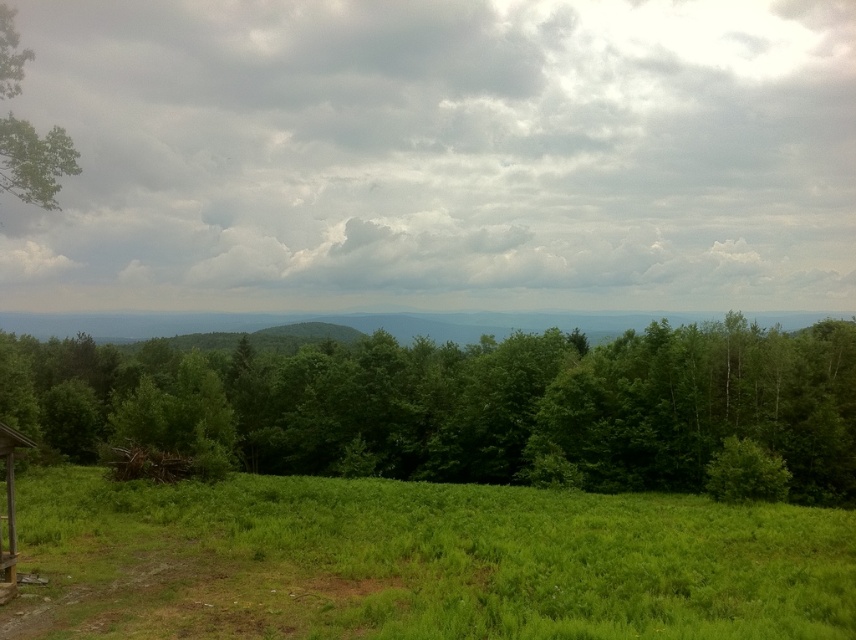
You are standing in the grassy field and see two points marked in the scene. Which point is closer to you, point (637,189) or point (70,168)?

Point (70,168) is closer to you because it is less further to the viewer than point (637,189).

You are a hiker carrying a backpack weighing 15 kilograms. You want to walk from the green grassy field at lower left to the green leafy tree at center. Given that the maximum distance you can walk with this load is 20 meters, will you be able to reach the tree without needing to rest?

The distance between the green grassy field at lower left and the green leafy tree at center is 22.86 meters, which exceeds your 20 meter limit. Therefore, you will need to rest before reaching the tree.